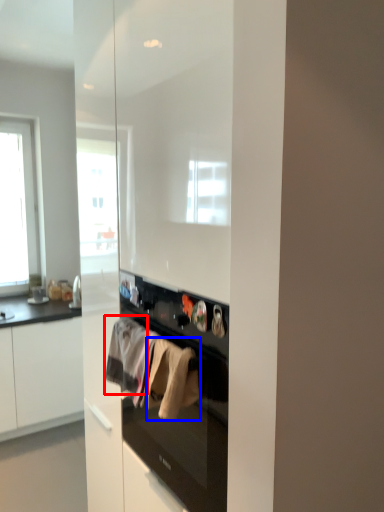
Question: Which of the following is the farthest to the observer, clothing (highlighted by a red box) or clothing (highlighted by a blue box)?

Choices:
 (A) clothing
 (B) clothing

Answer: (A)